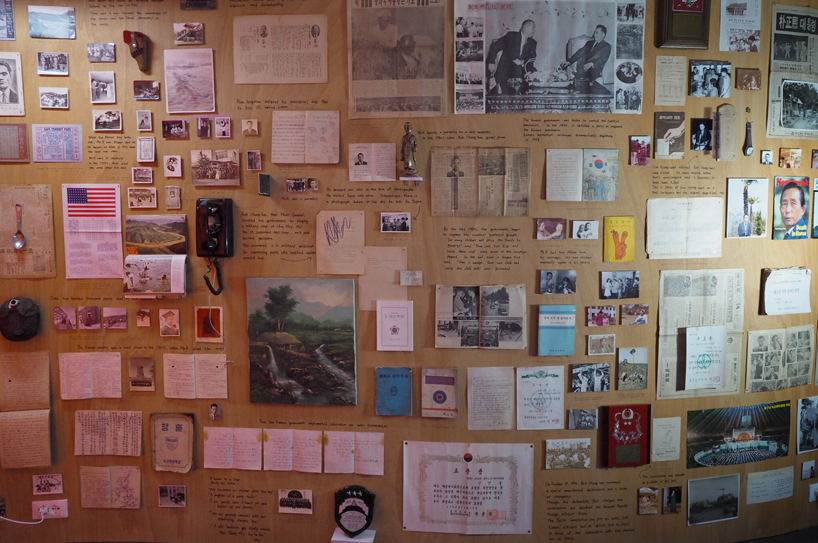
This screenshot has width=818, height=543. Find the location of `power outlet`. power outlet is located at coordinates (34, 505).